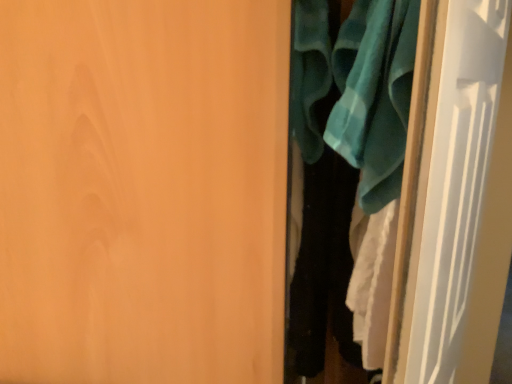
Question: In the image, is teal fabric bath towel at upper right positioned in front of or behind teal fabric clothes at right?

Choices:
 (A) front
 (B) behind

Answer: (A)

Question: In terms of width, does teal fabric bath towel at upper right look wider or thinner when compared to teal fabric clothes at right?

Choices:
 (A) thin
 (B) wide

Answer: (B)

Question: Estimate the real-world distances between objects in this image. Which object is closer to the teal fabric bath towel at upper right?

Choices:
 (A) teal fabric clothes at right
 (B) white glossy door at right, the second door viewed from the left
 (C) matte wood door at center, marked as the 2th door in a right-to-left arrangement

Answer: (A)

Question: Which object is the farthest from the teal fabric bath towel at upper right?

Choices:
 (A) white glossy door at right, the second door viewed from the left
 (B) teal fabric clothes at right
 (C) matte wood door at center, marked as the 2th door in a right-to-left arrangement

Answer: (C)